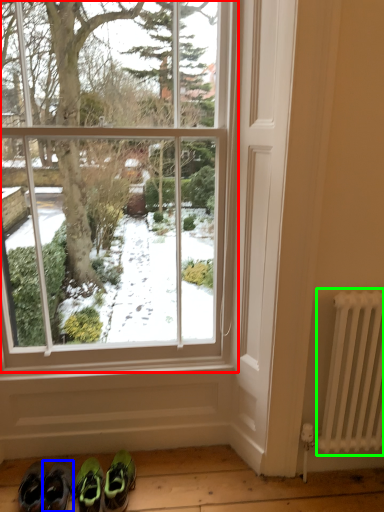
Question: Estimate the real-world distances between objects in this image. Which object is closer to window (highlighted by a red box), footwear (highlighted by a blue box) or radiator (highlighted by a green box)?

Choices:
 (A) footwear
 (B) radiator

Answer: (B)